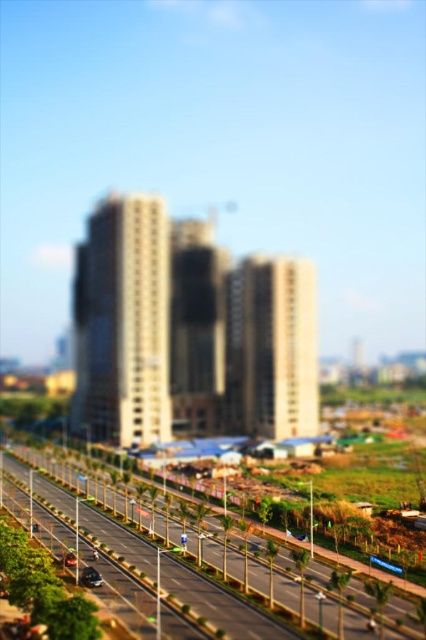
Is shiny black car at lower left closer to camera compared to shiny black car at center?

Yes, it is in front of shiny black car at center.

Who is lower down, shiny black car at lower left or shiny black car at center?

Positioned lower is shiny black car at center.

The image size is (426, 640). What are the coordinates of `shiny black car at lower left` in the screenshot? It's located at (91, 577).

How far apart are asphalt road at center and shiny black car at lower left?

asphalt road at center and shiny black car at lower left are 62.27 feet apart from each other.

The width and height of the screenshot is (426, 640). Describe the element at coordinates (141, 538) in the screenshot. I see `asphalt road at center` at that location.

At what (x,y) coordinates should I click in order to perform the action: click on asphalt road at center. Please return your answer as a coordinate pair (x, y). The width and height of the screenshot is (426, 640). Looking at the image, I should click on (141, 538).

Is point (256, 561) behind point (69, 564)?

Yes, point (256, 561) is farther from viewer.

Between asphalt road at center and shiny black car at center, which one appears on the left side from the viewer's perspective?

Positioned to the left is shiny black car at center.

Locate an element on the screen. asphalt road at center is located at coordinates (x=141, y=538).

Where is `asphalt road at center`? This screenshot has width=426, height=640. asphalt road at center is located at coordinates (141, 538).